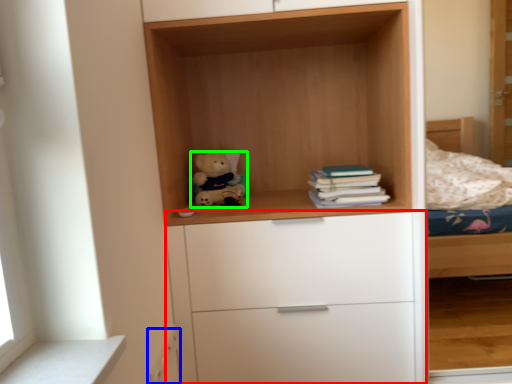
Question: Which object is positioned closest to chest of drawers (highlighted by a red box)? Select from drawer (highlighted by a blue box) and teddy bear (highlighted by a green box).

Choices:
 (A) drawer
 (B) teddy bear

Answer: (A)